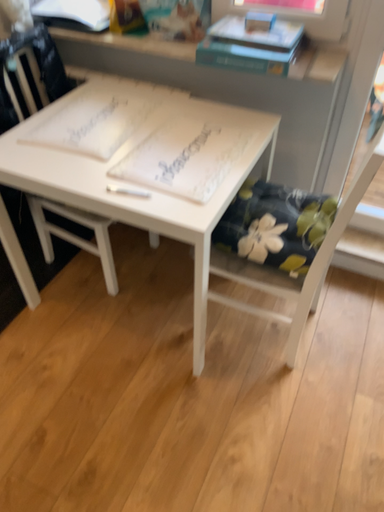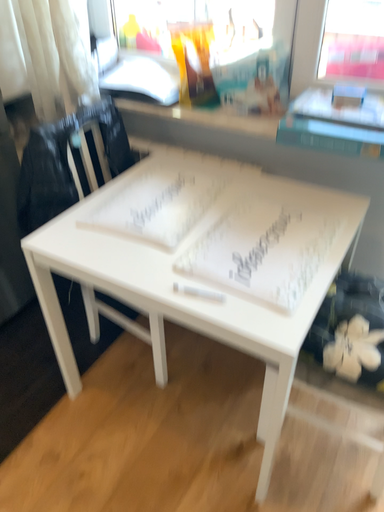
Question: How did the camera likely rotate when shooting the video?

Choices:
 (A) rotated upward
 (B) rotated downward

Answer: (A)